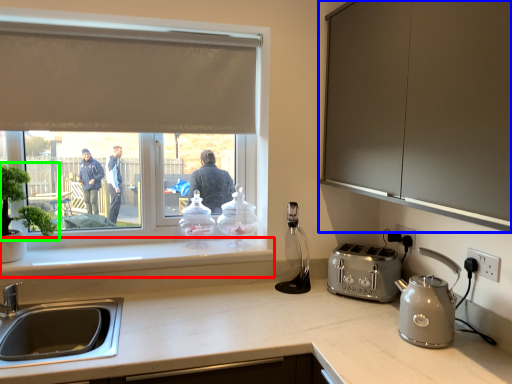
Question: Which is farther away from window sill (highlighted by a red box)? cabinetry (highlighted by a blue box) or plant (highlighted by a green box)?

Choices:
 (A) cabinetry
 (B) plant

Answer: (A)